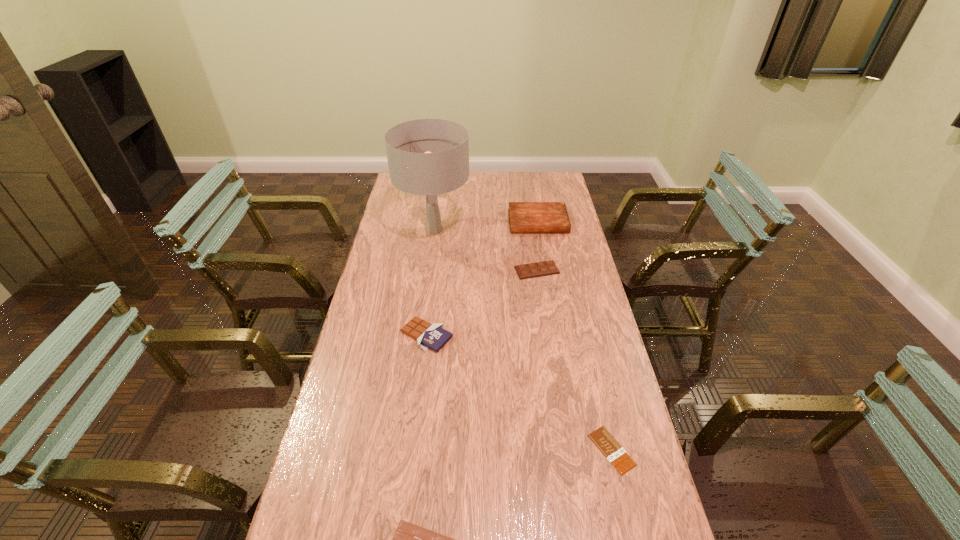
Locate an element on the screen. The height and width of the screenshot is (540, 960). free location that satisfies the following two spatial constraints: 1. on the front side of the fourth farthest object; 2. on the left side of the shortest chocolate bar is located at coordinates (413, 450).

What are the coordinates of `blank area in the image that satisfies the following two spatial constraints: 1. on the spine side of the fifth shortest object; 2. on the front-facing side of the tallest object` in the screenshot? It's located at (540, 230).

Locate an element on the screen. The image size is (960, 540). free spot that satisfies the following two spatial constraints: 1. on the back side of the tallest chocolate bar; 2. on the front-facing side of the lampshade is located at coordinates (439, 230).

Find the location of a particular element. vacant space that satisfies the following two spatial constraints: 1. on the spine side of the second tallest object; 2. on the left side of the shortest object is located at coordinates [578, 450].